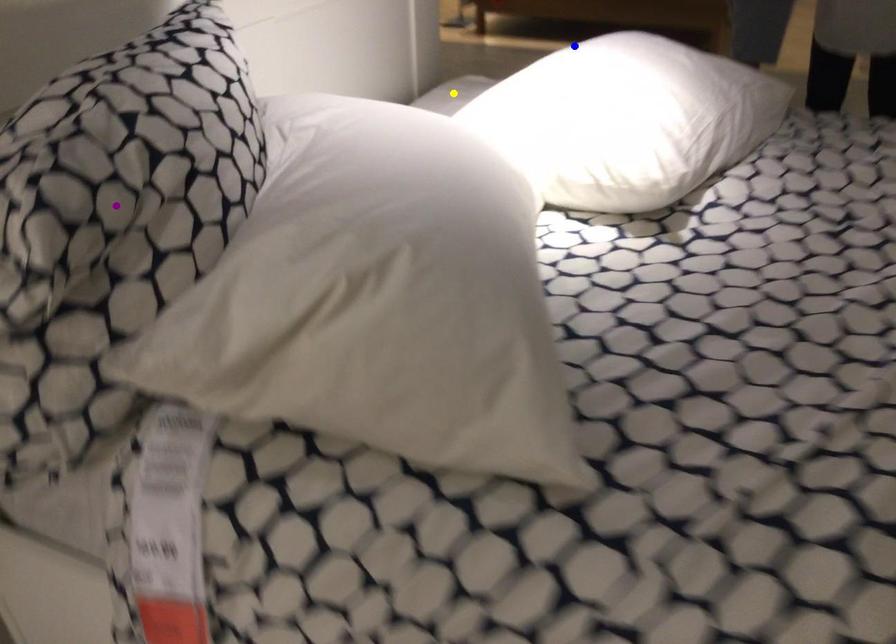
Order these from farthest to nearest:
blue point
yellow point
purple point

blue point → yellow point → purple point